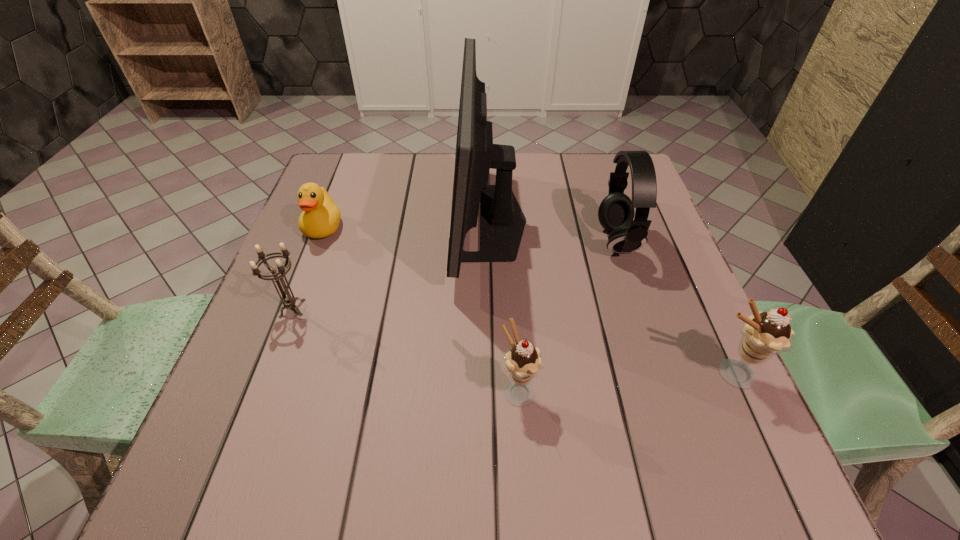
Find the location of a particular element. free space for a new icecream on the left is located at coordinates (295, 408).